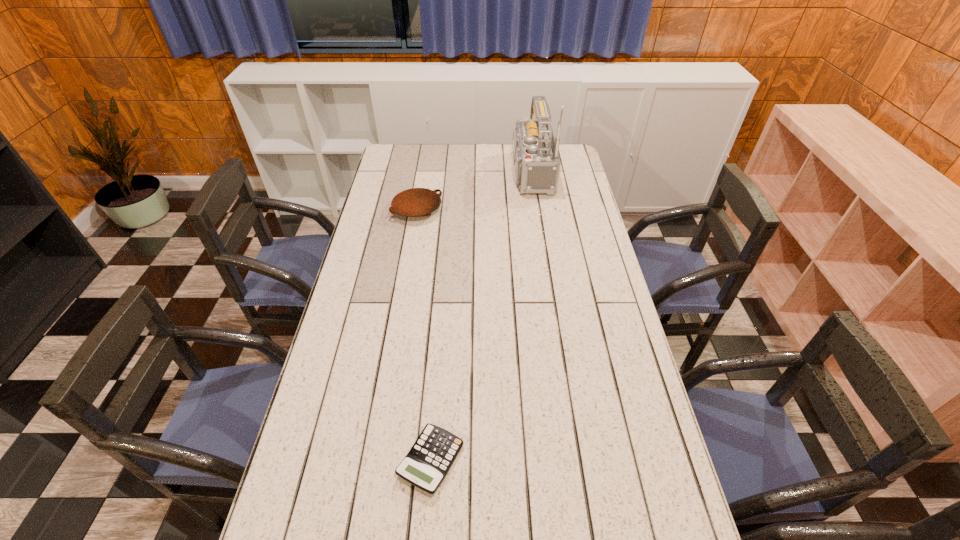
The width and height of the screenshot is (960, 540). I want to click on the rightmost object, so click(x=537, y=163).

Where is `the tallest object`? The width and height of the screenshot is (960, 540). the tallest object is located at coordinates (537, 163).

Where is `plate`? This screenshot has height=540, width=960. plate is located at coordinates (415, 202).

This screenshot has height=540, width=960. Find the location of `the nearest object`. the nearest object is located at coordinates (427, 463).

You are a GUI agent. You are given a task and a screenshot of the screen. Output one action in this format:
    pyautogui.click(x=<x>, y=<y>)
    Task: Click on the shortest object
    
    Given the screenshot: What is the action you would take?
    pyautogui.click(x=427, y=463)

The width and height of the screenshot is (960, 540). Identify the location of free point located 0.310m on the front-facing side of the tallest object. (431, 173).

This screenshot has height=540, width=960. What are the coordinates of `vacant space located 0.240m on the front-facing side of the tallest object` in the screenshot? It's located at (446, 173).

Identify the location of vacant space situated on the front-facing side of the tallest object. (458, 173).

Where is `vacant space situated 0.070m on the back of the second tallest object`? This screenshot has height=540, width=960. vacant space situated 0.070m on the back of the second tallest object is located at coordinates (421, 186).

You are a GUI agent. You are given a task and a screenshot of the screen. Output one action in this format:
    pyautogui.click(x=<x>, y=<y>)
    Task: Click on the vacant space situated on the right of the nearest object
    This screenshot has width=960, height=540.
    Given the screenshot: What is the action you would take?
    pyautogui.click(x=574, y=460)